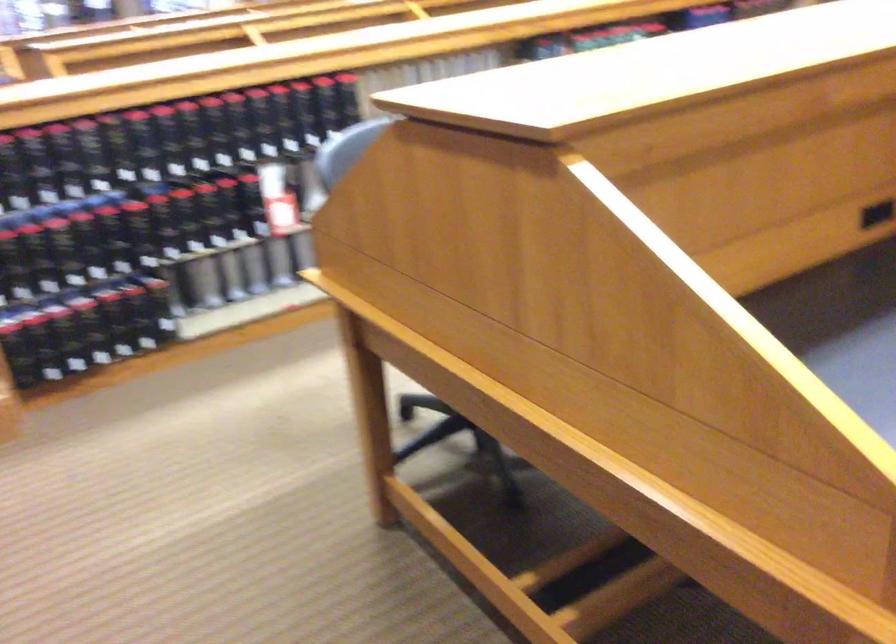
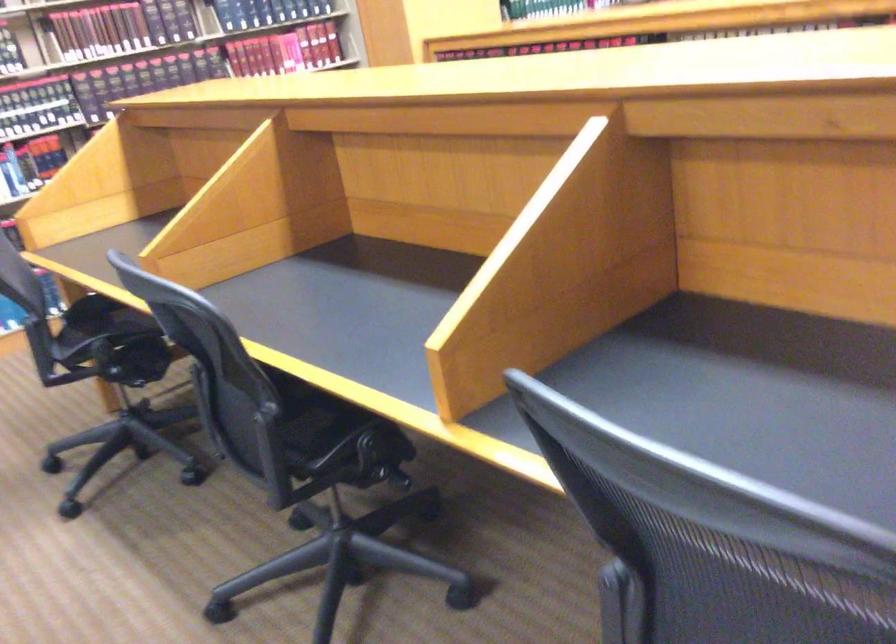
Question: I am providing you with two images of the same scene from different viewpoints. Please identify which objects are invisible in image2.

Choices:
 (A) mannequin head
 (B) hardcover book
 (C) black binder
 (D) chair sitting surface

Answer: (C)